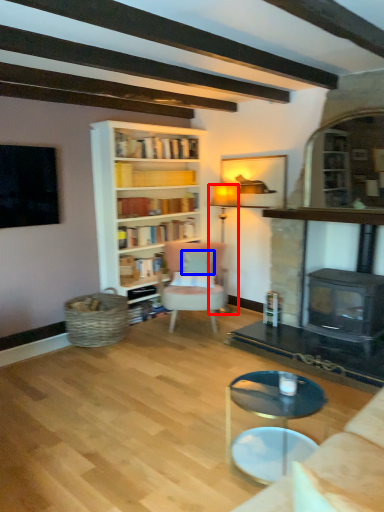
Question: Which object appears closest to the camera in this image, lamp (highlighted by a red box) or pillow (highlighted by a blue box)?

Choices:
 (A) lamp
 (B) pillow

Answer: (B)